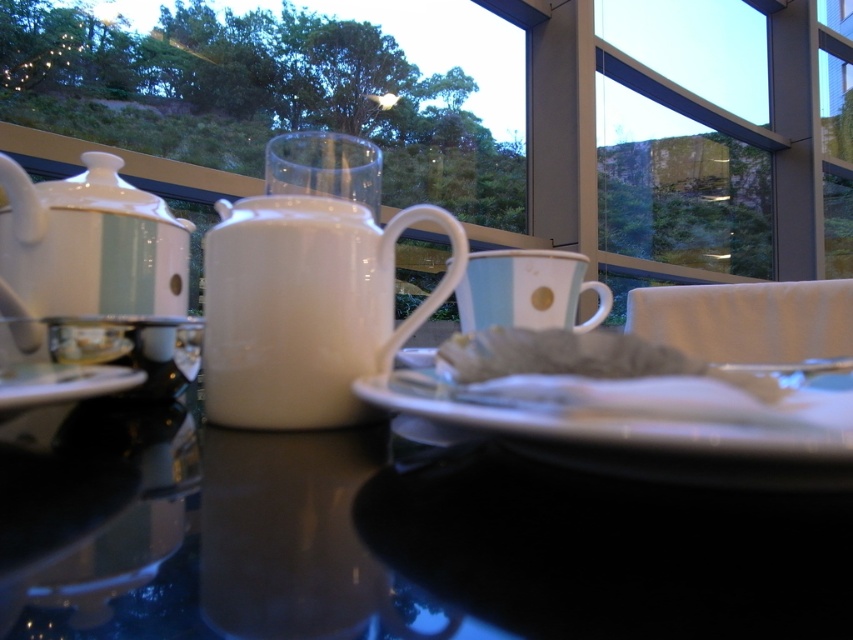
Can you confirm if white glossy mug at center is wider than transparent glass at center?

Yes, white glossy mug at center is wider than transparent glass at center.

In order to click on white glossy mug at center in this screenshot , I will do `click(305, 307)`.

Does point (415, 220) lie behind point (375, 164)?

No, (415, 220) is closer to viewer.

This screenshot has height=640, width=853. I want to click on white glossy mug at center, so click(305, 307).

The image size is (853, 640). In order to click on white glossy plate at center in this screenshot , I will do `click(647, 408)`.

Who is more distant from viewer, (602, 419) or (28, 396)?

The point (28, 396) is behind.

Image resolution: width=853 pixels, height=640 pixels. Identify the location of white glossy plate at center. (647, 408).

Does point (119, 596) come closer to viewer compared to point (553, 326)?

Yes, it is.

Does glossy ceramic mug at upper center appear on the right side of light blue ceramic mug at center?

In fact, glossy ceramic mug at upper center is to the left of light blue ceramic mug at center.

Does point (241, 477) come in front of point (498, 266)?

Yes, it is.

The image size is (853, 640). Identify the location of glossy ceramic mug at upper center. (381, 540).